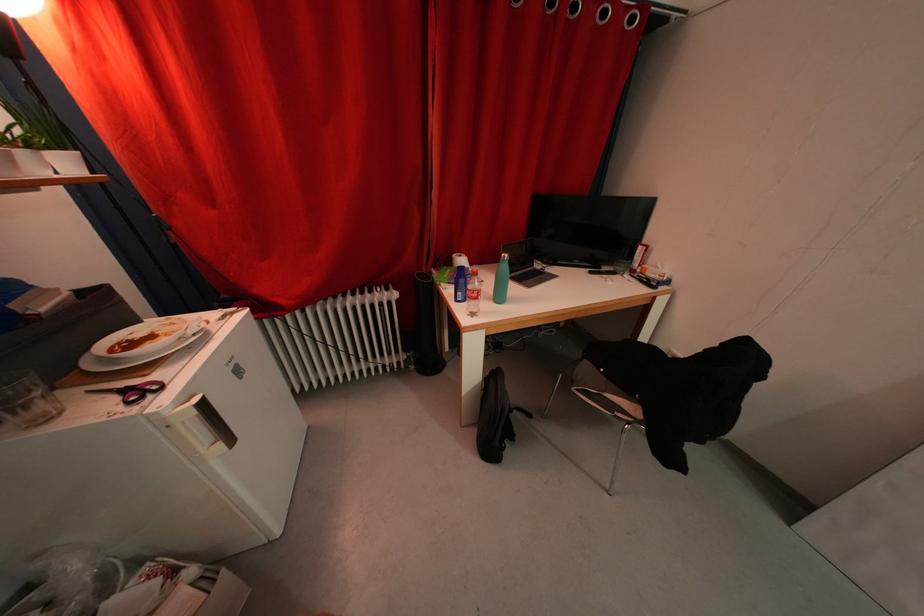
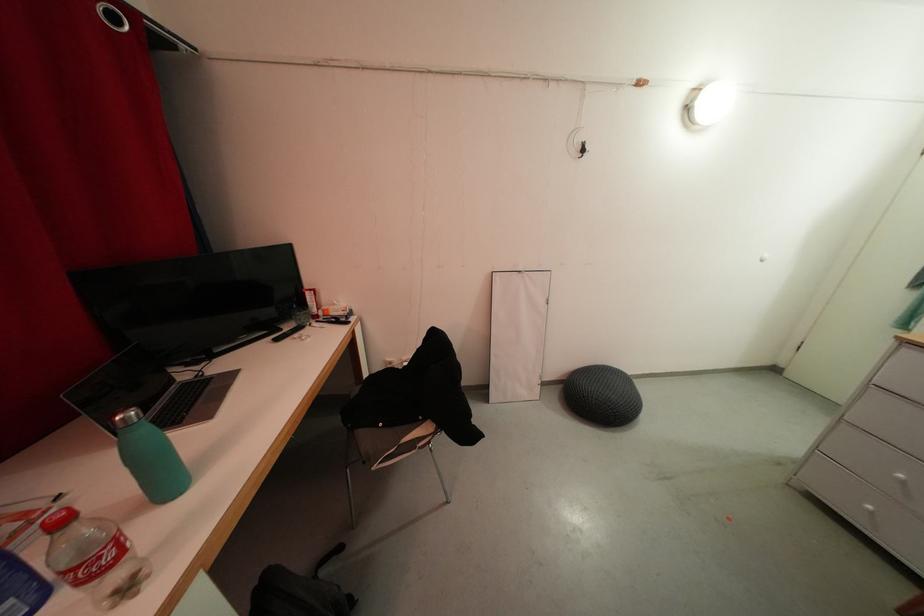
The point at (611, 272) is marked in the first image. Where is the corresponding point in the second image?

(293, 331)